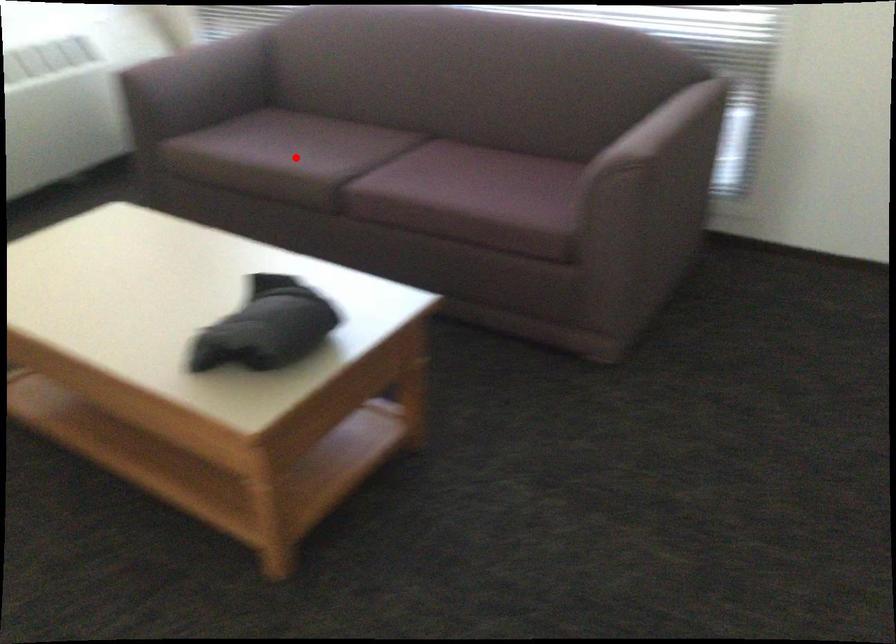
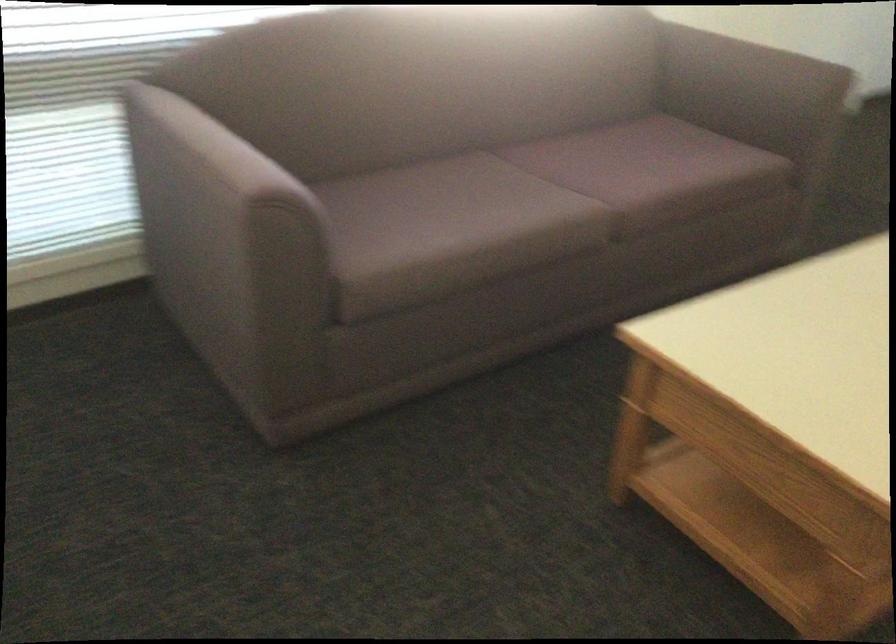
Question: I am providing you with two images of the same scene from different viewpoints. In image1, a red point is highlighted. Considering the same 3D point in image2, which of the following is correct?

Choices:
 (A) It is closer
 (B) It is farther

Answer: (A)